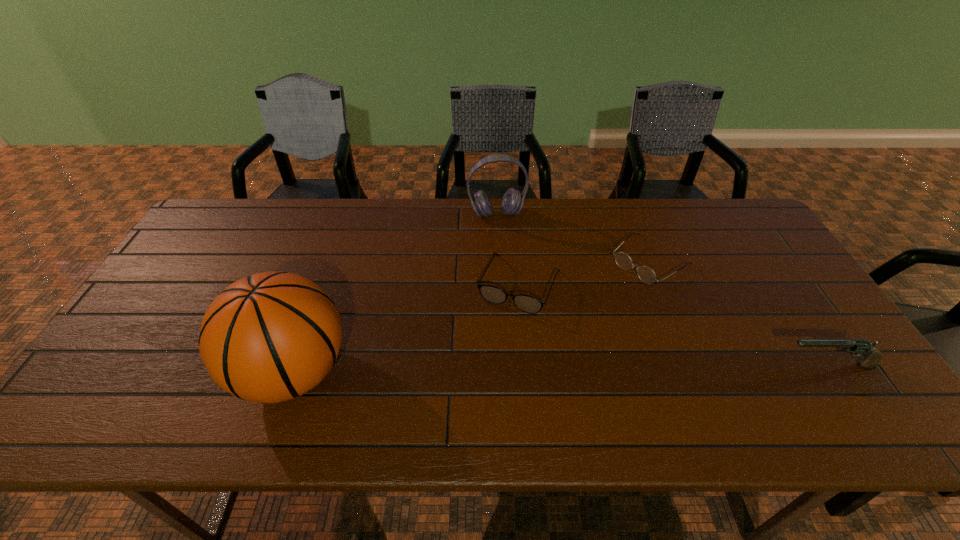
Where is `basketball`? Image resolution: width=960 pixels, height=540 pixels. basketball is located at coordinates (270, 337).

Where is `the leftmost object`? The width and height of the screenshot is (960, 540). the leftmost object is located at coordinates (270, 337).

Identify the location of gun. Image resolution: width=960 pixels, height=540 pixels. (860, 347).

The height and width of the screenshot is (540, 960). I want to click on the third tallest object, so click(x=860, y=347).

Where is `the right spectacles`? The height and width of the screenshot is (540, 960). the right spectacles is located at coordinates (646, 274).

Where is `the shorter spectacles`? This screenshot has height=540, width=960. the shorter spectacles is located at coordinates (646, 274).

This screenshot has height=540, width=960. I want to click on headset, so click(x=512, y=202).

Where is `the farthest object`? The image size is (960, 540). the farthest object is located at coordinates (512, 202).

Identify the location of the left spectacles. (528, 304).

In order to click on vacant region located on the back of the leftmost object in this screenshot , I will do `click(319, 301)`.